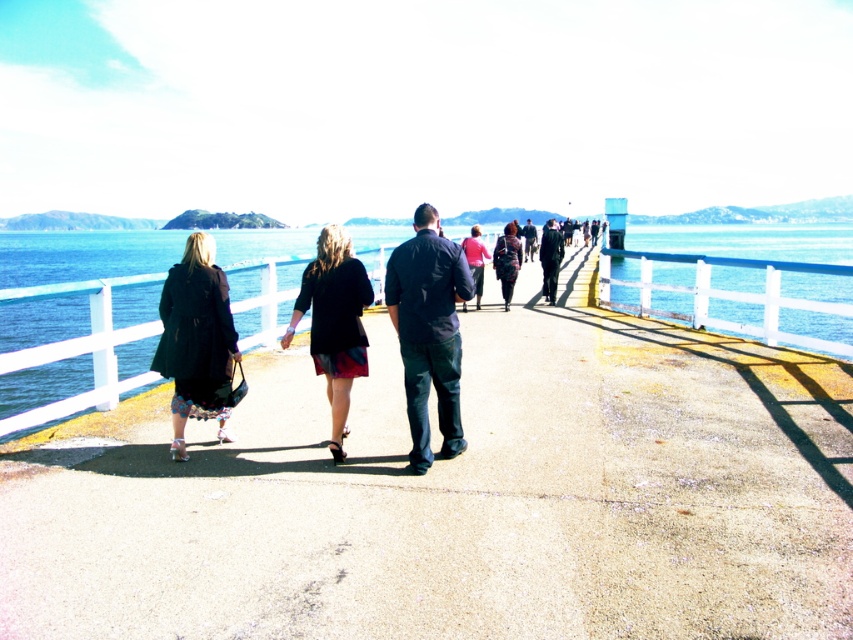
Is point (316, 369) closer to camera compared to point (476, 289)?

Yes, it is.

Consider the image. Can you confirm if black leather jacket at center is thinner than matte pink sweater at center?

Indeed, black leather jacket at center has a lesser width compared to matte pink sweater at center.

What do you see at coordinates (334, 323) in the screenshot?
I see `black leather jacket at center` at bounding box center [334, 323].

At what (x,y) coordinates should I click in order to perform the action: click on black leather jacket at center. Please return your answer as a coordinate pair (x, y). Looking at the image, I should click on (334, 323).

Can you confirm if dark blue shirt at center is taller than matte black coat at left?

Yes.

The height and width of the screenshot is (640, 853). In order to click on dark blue shirt at center in this screenshot , I will do `click(428, 332)`.

The image size is (853, 640). I want to click on dark blue shirt at center, so click(428, 332).

Can you confirm if black leather jacket at center is wider than fluffy black coat at center?

Correct, the width of black leather jacket at center exceeds that of fluffy black coat at center.

Is point (305, 305) positioned after point (512, 266)?

No, it is in front of (512, 266).

Image resolution: width=853 pixels, height=640 pixels. Find the location of `black leather jacket at center`. black leather jacket at center is located at coordinates click(x=334, y=323).